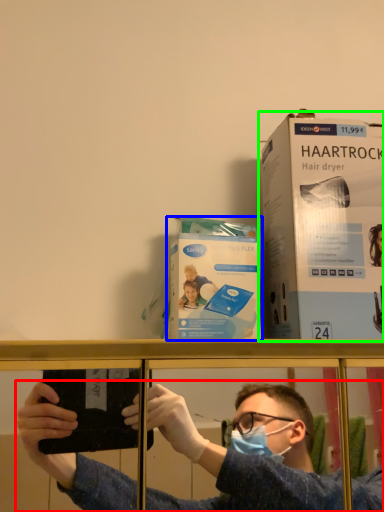
Question: Estimate the real-world distances between objects in this image. Which object is farther from person (highlighted by a red box), paperback book (highlighted by a blue box) or paperback book (highlighted by a green box)?

Choices:
 (A) paperback book
 (B) paperback book

Answer: (A)